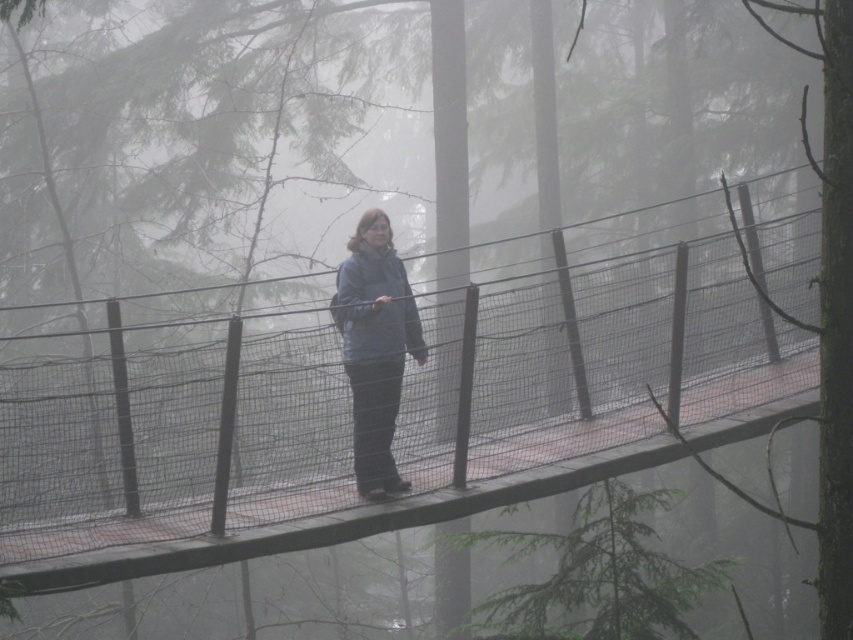
Measure the distance between point [781,214] and camera.

The distance of point [781,214] from camera is 24.86 meters.

You are a GUI agent. You are given a task and a screenshot of the screen. Output one action in this format:
    pyautogui.click(x=<x>, y=<y>)
    Task: Click on the wooden at center
    The image size is (853, 640).
    Given the screenshot: What is the action you would take?
    pyautogui.click(x=398, y=420)